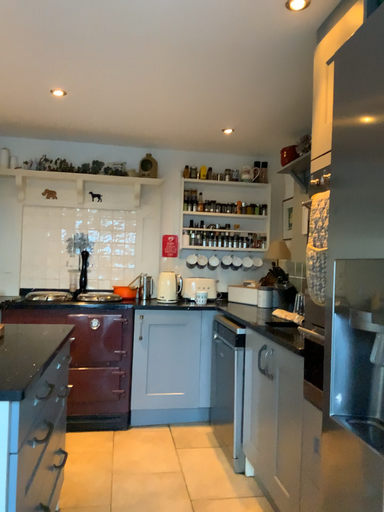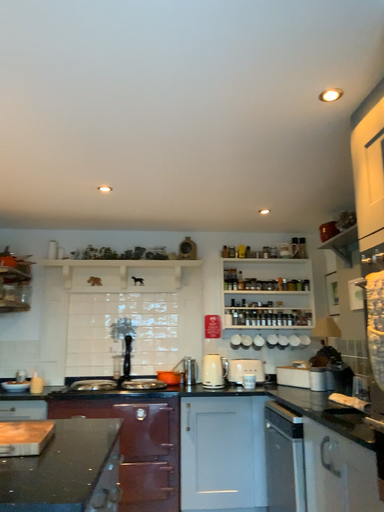
Question: How did the camera likely rotate when shooting the video?

Choices:
 (A) rotated downward
 (B) rotated upward

Answer: (B)